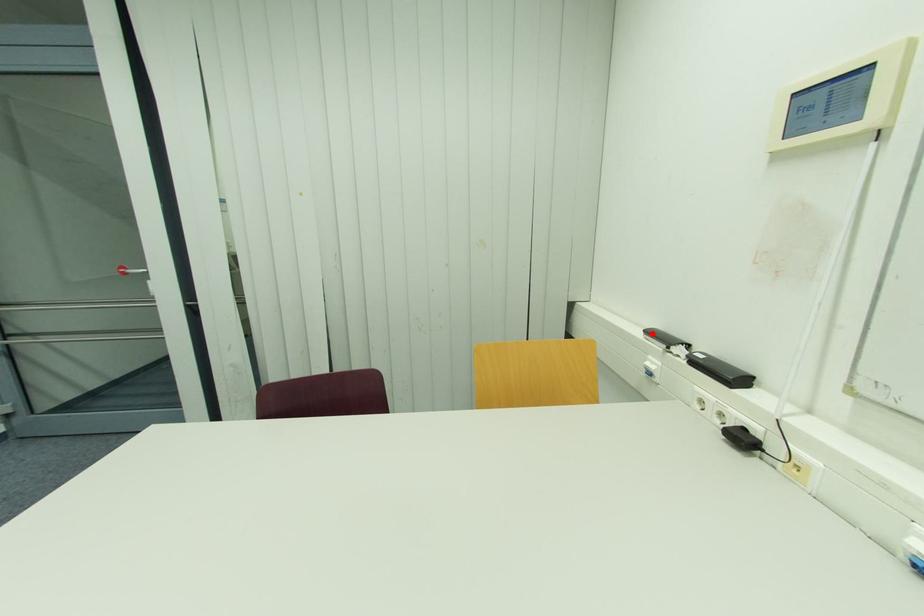
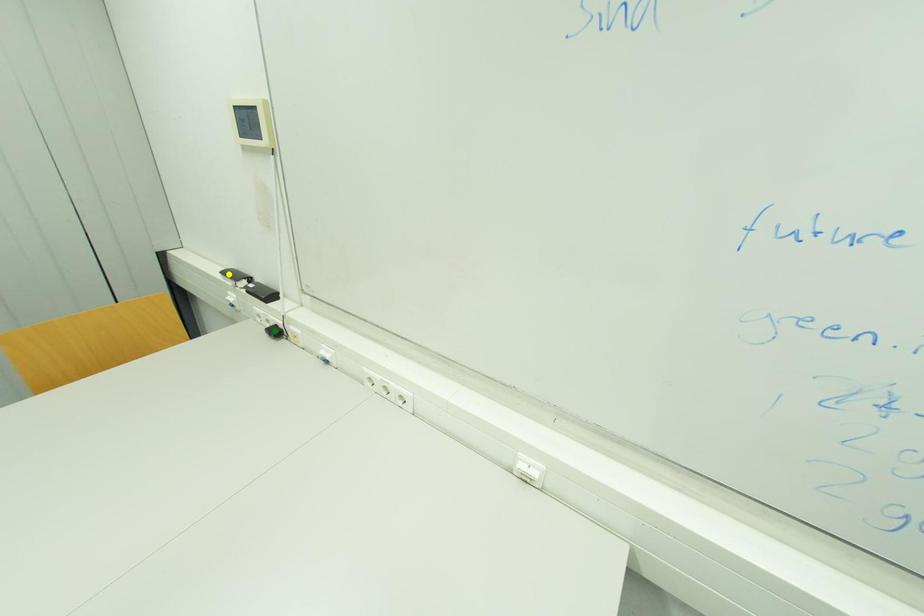
Question: I am providing you with two images of the same scene from different viewpoints. A red point is marked on the first image. You are given multiple points on the second image. Which point in image 2 is actually the same real-world point as the red point in image 1?

Choices:
 (A) yellow point
 (B) blue point
 (C) green point

Answer: (A)